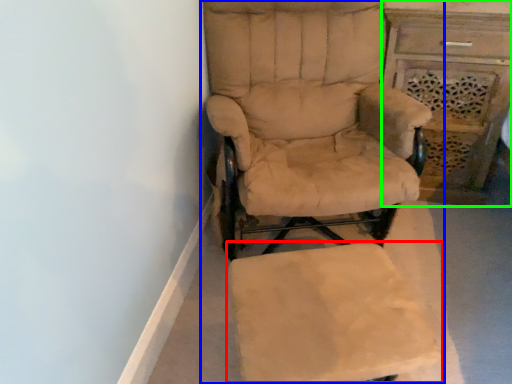
Question: Estimate the real-world distances between objects in this image. Which object is farther from swivel chair (highlighted by a red box), chair (highlighted by a blue box) or vanity (highlighted by a green box)?

Choices:
 (A) chair
 (B) vanity

Answer: (B)